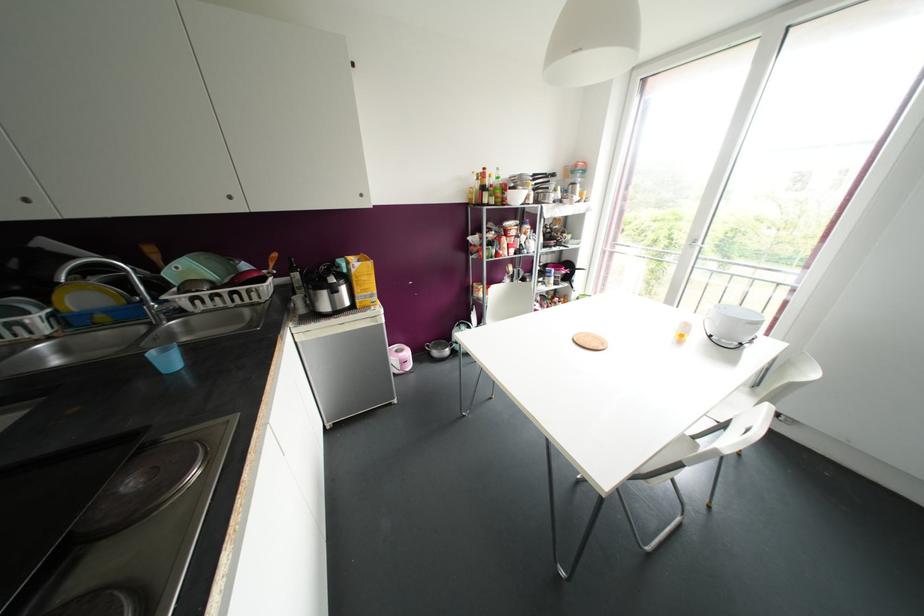
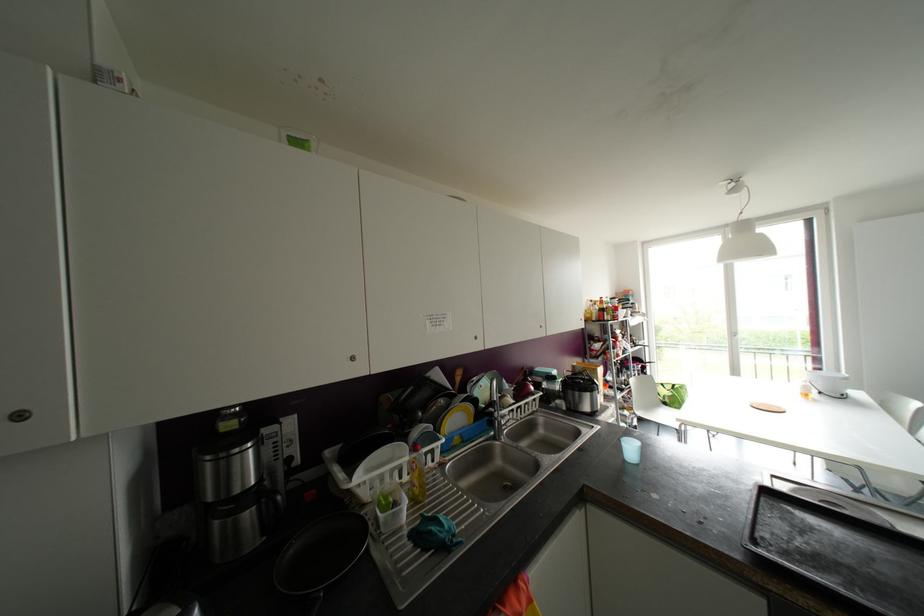
Where in the second image is the point corresponding to pixel 150 307 from the first image?

(499, 422)